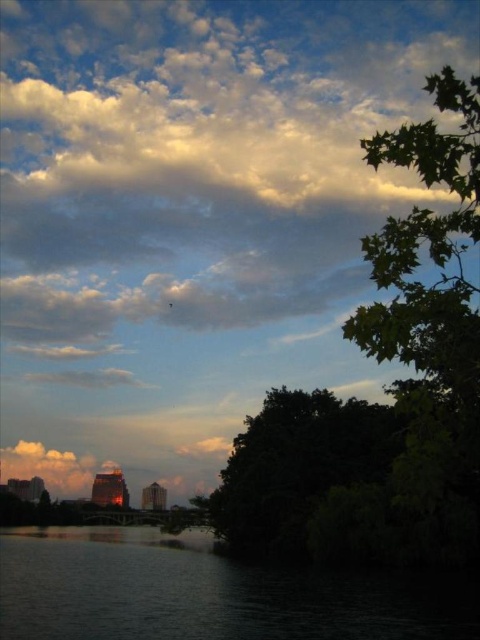
You are standing at the edge of the dark water at lower left and want to look at the green leafy tree at upper right. Which direction should you turn your head to see it?

You should turn your head to the right to see the green leafy tree at upper right because it is located to the right side of the dark water at lower left.

You are standing at the center of the scene and want to determine which object is taller. You can see the dark water at lower left and the dark green leafy tree at lower right. Which one is taller?

The dark water at lower left has a greater height compared to the dark green leafy tree at lower right, so the dark water at lower left is taller.

You are standing at the center of the scene and want to walk towards the dark green leafy tree at lower right. Which direction should you head to avoid stepping into the dark water at lower left?

You should head towards the dark green leafy tree at lower right while moving away from the dark water at lower left, since the dark water at lower left is below the dark green leafy tree at lower right, meaning it is located lower in the scene. To avoid stepping into the dark water at lower left, you should move towards the tree and away from the lower area where the water is located.